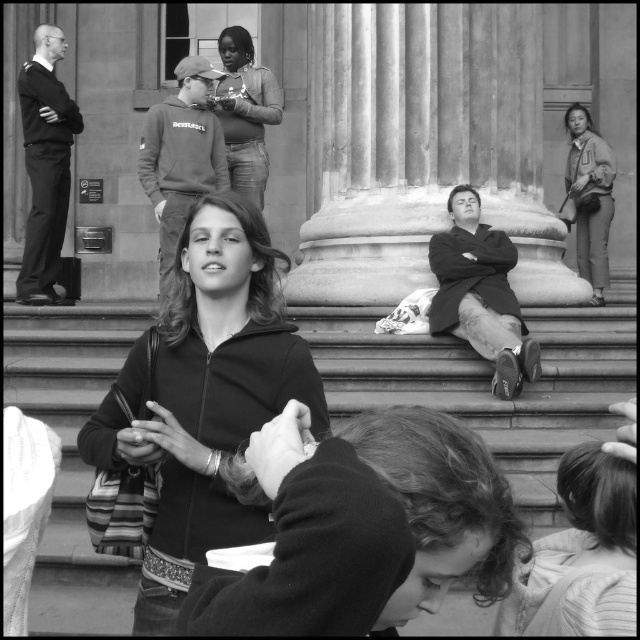
You are standing in the urban scene depicted in the image. There is a point marked at coordinates (205,397). What object is located at that point?

The black matte jacket at center is located at point (205,397).